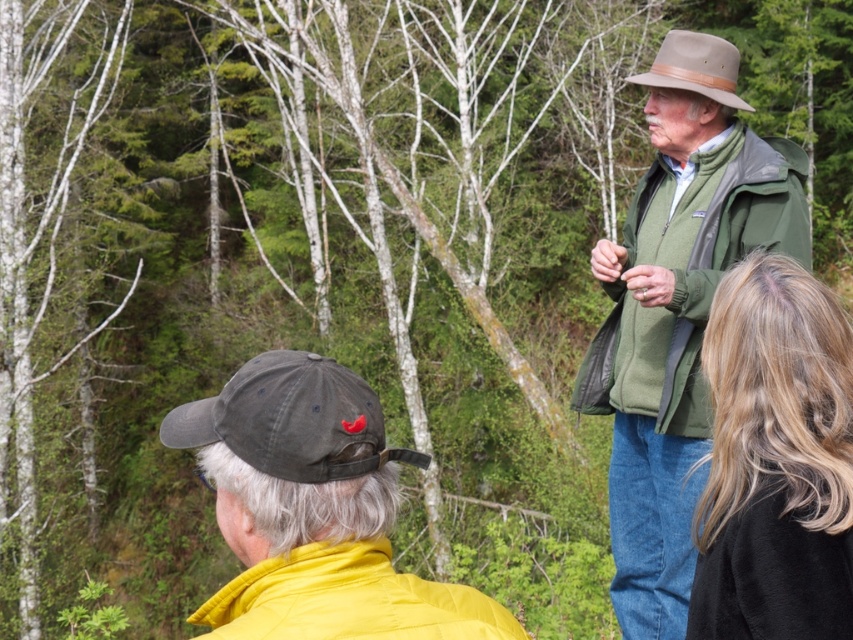
Which is below, blonde hair at center or yellow quilted jacket at lower left?

yellow quilted jacket at lower left is lower down.

Can you confirm if blonde hair at center is positioned to the left of yellow quilted jacket at lower left?

In fact, blonde hair at center is to the right of yellow quilted jacket at lower left.

This screenshot has height=640, width=853. What are the coordinates of `blonde hair at center` in the screenshot? It's located at (775, 460).

Which is above, yellow fabric jacket at lower left or green fleece jacket at upper right?

Result: green fleece jacket at upper right is higher up.

Is yellow fabric jacket at lower left closer to the viewer compared to green fleece jacket at upper right?

Yes, yellow fabric jacket at lower left is in front of green fleece jacket at upper right.

Does point (387, 554) lie in front of point (741, 253)?

Yes, point (387, 554) is in front of point (741, 253).

You are a GUI agent. You are given a task and a screenshot of the screen. Output one action in this format:
    pyautogui.click(x=<x>, y=<y>)
    Task: Click on the yellow fabric jacket at lower left
    The image size is (853, 640).
    Given the screenshot: What is the action you would take?
    pyautogui.click(x=314, y=509)

Image resolution: width=853 pixels, height=640 pixels. Describe the element at coordinates (347, 600) in the screenshot. I see `yellow quilted jacket at lower left` at that location.

Who is more forward, (462, 598) or (747, 211)?

Positioned in front is point (462, 598).

Which is in front, point (305, 614) or point (721, 211)?

Positioned in front is point (305, 614).

Where is `yellow quilted jacket at lower left`? yellow quilted jacket at lower left is located at coordinates (347, 600).